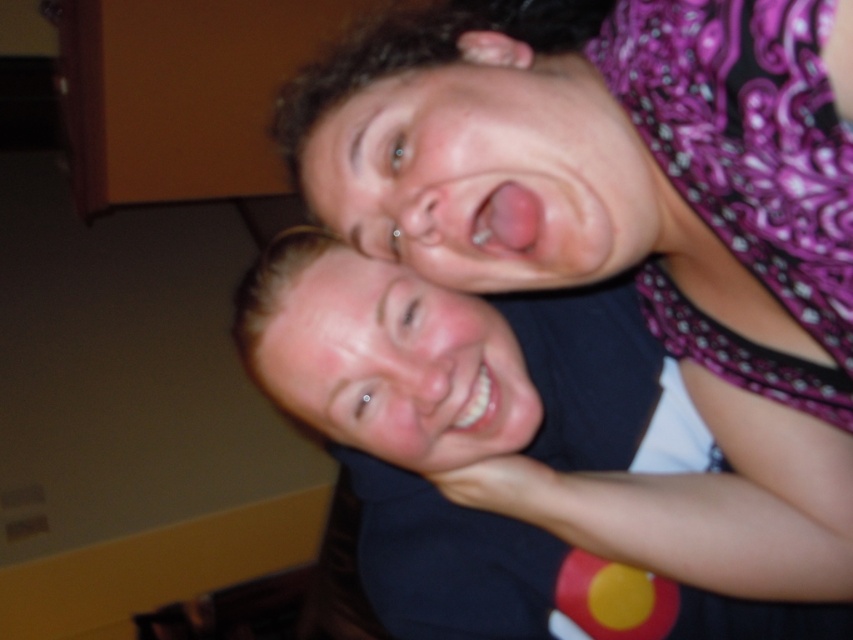
Is matte black shirt at upper center positioned in front of matte skin face at upper center?

No, matte black shirt at upper center is further to the viewer.

Between matte black shirt at upper center and matte skin face at upper center, which one is positioned lower?

matte black shirt at upper center is lower down.

The height and width of the screenshot is (640, 853). I want to click on matte black shirt at upper center, so click(485, 440).

Locate an element on the screen. matte skin face at upper center is located at coordinates (485, 173).

The width and height of the screenshot is (853, 640). Find the location of `matte skin face at upper center`. matte skin face at upper center is located at coordinates (485, 173).

Based on the photo, is matte black shirt at upper center below smooth skin face at center?

Indeed, matte black shirt at upper center is positioned under smooth skin face at center.

Between matte black shirt at upper center and smooth skin face at center, which one appears on the right side from the viewer's perspective?

matte black shirt at upper center

Does point (500, 406) come closer to viewer compared to point (355, 264)?

No.

Locate an element on the screen. matte black shirt at upper center is located at coordinates (485, 440).